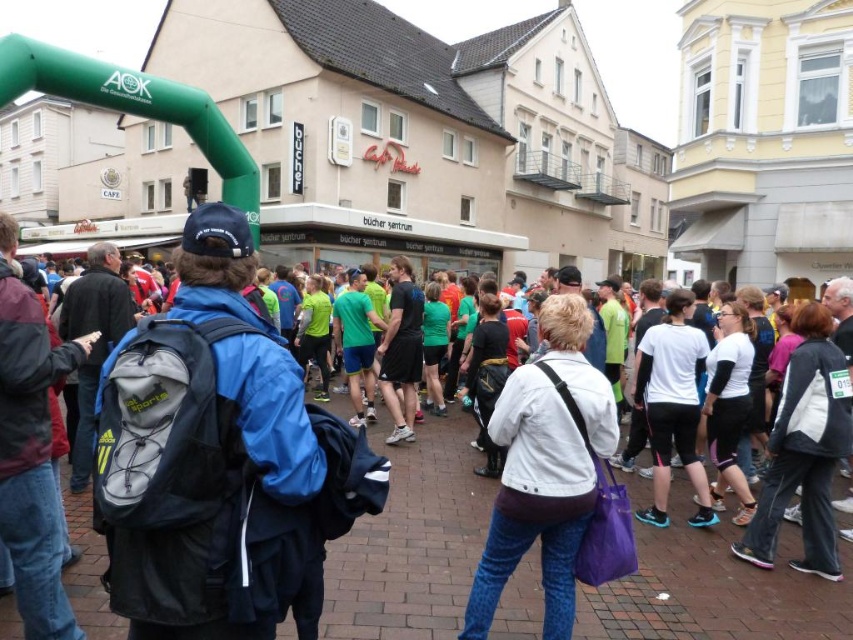
Does matte gray backpack at center have a lesser height compared to white matte jacket at center?

No.

Does matte gray backpack at center come in front of white matte jacket at center?

Yes.

Does point (113, 397) lie behind point (561, 342)?

No, (113, 397) is in front of (561, 342).

Where is `matte gray backpack at center`? The image size is (853, 640). matte gray backpack at center is located at coordinates (216, 449).

Can you confirm if blue synthetic jacket at center is positioned below matte gray backpack at center?

No.

Who is higher up, blue synthetic jacket at center or matte gray backpack at center?

blue synthetic jacket at center

Who is more forward, (328,433) or (144,592)?

Point (144,592)

You are a GUI agent. You are given a task and a screenshot of the screen. Output one action in this format:
    pyautogui.click(x=<x>, y=<y>)
    Task: Click on the blue synthetic jacket at center
    
    Given the screenshot: What is the action you would take?
    pyautogui.click(x=225, y=460)

Between blue synthetic jacket at center and white matte jacket at center, which one appears on the right side from the viewer's perspective?

white matte jacket at center is more to the right.

Does point (285, 412) lie in front of point (618, 424)?

Yes.

Is point (173, 451) behind point (498, 394)?

That is False.

You are a GUI agent. You are given a task and a screenshot of the screen. Output one action in this format:
    pyautogui.click(x=<x>, y=<y>)
    Task: Click on the blue synthetic jacket at center
    This screenshot has height=640, width=853.
    Given the screenshot: What is the action you would take?
    pyautogui.click(x=225, y=460)